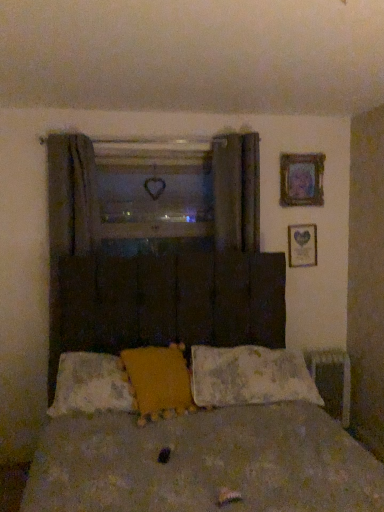
Question: Can you confirm if dark gray fabric curtain at left, the 1th curtain positioned from the left, is shorter than fluffy white pillow at center, acting as the 3th pillow starting from the right?

Choices:
 (A) no
 (B) yes

Answer: (A)

Question: From the image's perspective, is dark gray fabric curtain at left, the 1th curtain positioned from the left, over fluffy white pillow at center, which is counted as the first pillow, starting from the left?

Choices:
 (A) no
 (B) yes

Answer: (B)

Question: Is dark gray fabric curtain at left, the 1th curtain positioned from the left, positioned beyond the bounds of fluffy white pillow at center, acting as the 3th pillow starting from the right?

Choices:
 (A) no
 (B) yes

Answer: (B)

Question: Is dark gray fabric curtain at left, the 1th curtain positioned from the left, in contact with fluffy white pillow at center, acting as the 3th pillow starting from the right?

Choices:
 (A) yes
 (B) no

Answer: (B)

Question: Is dark gray fabric curtain at left, the 1th curtain positioned from the left, closer to the viewer compared to fluffy white pillow at center, acting as the 3th pillow starting from the right?

Choices:
 (A) yes
 (B) no

Answer: (B)

Question: Based on their sizes in the image, would you say textured brown bed at center is bigger or smaller than dark gray fabric curtain at left, which ranks as the 2th curtain in right-to-left order?

Choices:
 (A) small
 (B) big

Answer: (B)

Question: Is point (253, 483) closer or farther from the camera than point (76, 343)?

Choices:
 (A) closer
 (B) farther

Answer: (A)

Question: From a real-world perspective, is textured brown bed at center physically located above or below dark gray fabric curtain at left, the 1th curtain positioned from the left?

Choices:
 (A) above
 (B) below

Answer: (B)

Question: Visually, is textured brown bed at center positioned to the left or to the right of dark gray fabric curtain at left, the 1th curtain positioned from the left?

Choices:
 (A) left
 (B) right

Answer: (B)

Question: Considering the positions of yellow fabric pillow at center, which ranks as the 2th pillow in right-to-left order, and fluffy white pillow at center, acting as the first pillow starting from the right, in the image, is yellow fabric pillow at center, which ranks as the 2th pillow in right-to-left order, wider or thinner than fluffy white pillow at center, acting as the first pillow starting from the right,?

Choices:
 (A) wide
 (B) thin

Answer: (B)

Question: From the image's perspective, is yellow fabric pillow at center, positioned as the 2th pillow in left-to-right order, located above or below fluffy white pillow at center, acting as the first pillow starting from the right?

Choices:
 (A) below
 (B) above

Answer: (B)

Question: Is yellow fabric pillow at center, positioned as the 2th pillow in left-to-right order, situated inside fluffy white pillow at center, which appears as the 3th pillow when viewed from the left, or outside?

Choices:
 (A) outside
 (B) inside

Answer: (A)

Question: Is yellow fabric pillow at center, which ranks as the 2th pillow in right-to-left order, taller or shorter than fluffy white pillow at center, acting as the first pillow starting from the right?

Choices:
 (A) short
 (B) tall

Answer: (B)

Question: Is wooden picture frame at upper right, which is the second picture frame in bottom-to-top order, inside the boundaries of wooden frame at center, or outside?

Choices:
 (A) inside
 (B) outside

Answer: (B)

Question: Considering the positions of wooden picture frame at upper right, which is the second picture frame in bottom-to-top order, and wooden frame at center in the image, is wooden picture frame at upper right, which is the second picture frame in bottom-to-top order, taller or shorter than wooden frame at center?

Choices:
 (A) short
 (B) tall

Answer: (A)